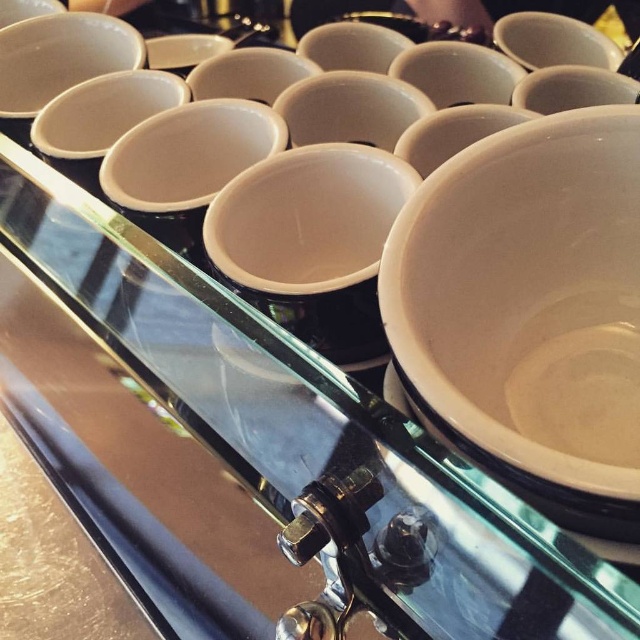
Question: Which point appears farthest from the camera in this image?

Choices:
 (A) (637, 508)
 (B) (547, 65)
 (C) (19, 102)

Answer: (B)

Question: Which object is the farthest from the white glossy bowl at upper left?

Choices:
 (A) white glossy saucer at center
 (B) white glossy bowl at upper right
 (C) white matte bowl at center

Answer: (A)

Question: Among these points, which one is farthest from the camera?

Choices:
 (A) (582, 40)
 (B) (45, 84)
 (C) (452, 211)
 (D) (566, 500)

Answer: (B)

Question: Is white matte bowl at center thinner than white glossy saucer at center?

Choices:
 (A) yes
 (B) no

Answer: (B)

Question: From the image, what is the correct spatial relationship of white glossy bowl at upper left in relation to white glossy saucer at center?

Choices:
 (A) above
 (B) below

Answer: (A)

Question: Observing the image, what is the correct spatial positioning of white matte bowl at center in reference to white glossy bowl at upper right?

Choices:
 (A) above
 (B) below

Answer: (B)